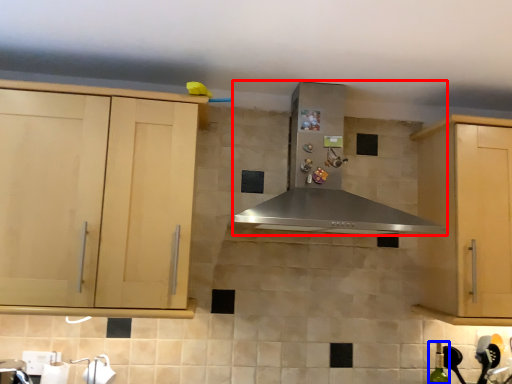
Question: Which point is closer to the camera, home appliance (highlighted by a red box) or bottle (highlighted by a blue box)?

Choices:
 (A) home appliance
 (B) bottle

Answer: (A)